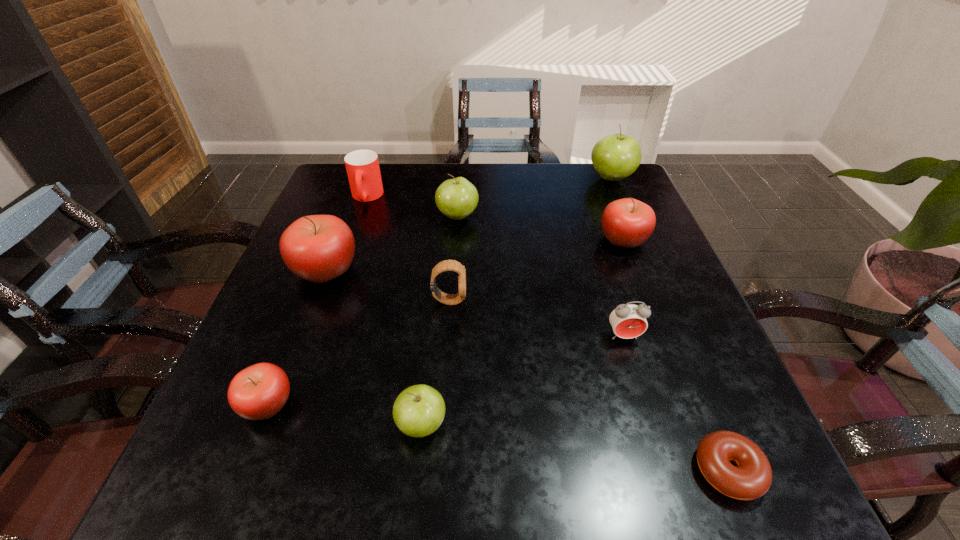
You are a GUI agent. You are given a task and a screenshot of the screen. Output one action in this format:
    pyautogui.click(x=<x>, y=<y>)
    Task: Click on the free space located 0.270m on the back of the smallest green apple
    This screenshot has height=540, width=960.
    Given the screenshot: What is the action you would take?
    pyautogui.click(x=436, y=289)

This screenshot has height=540, width=960. Identify the location of free region located 0.380m on the back of the nearest red apple. (330, 244).

Identify the location of vacant position located on the left of the shortest object. Image resolution: width=960 pixels, height=540 pixels. (660, 470).

Identify the location of cup that is at the far edge. (362, 166).

This screenshot has height=540, width=960. Identify the location of apple that is at the near edge. (418, 411).

Image resolution: width=960 pixels, height=540 pixels. Find the location of `doughnut at the near edge`. doughnut at the near edge is located at coordinates (752, 478).

Locate an element on the screen. cup that is at the left edge is located at coordinates (362, 166).

At what (x,y) coordinates should I click in order to perform the action: click on alarm clock that is at the right edge. Please return your answer as a coordinate pair (x, y). Looking at the image, I should click on (628, 321).

Where is `doughnut that is at the right edge`? The image size is (960, 540). doughnut that is at the right edge is located at coordinates (752, 478).

Identify the location of object at the far left corner. The image size is (960, 540). (362, 166).